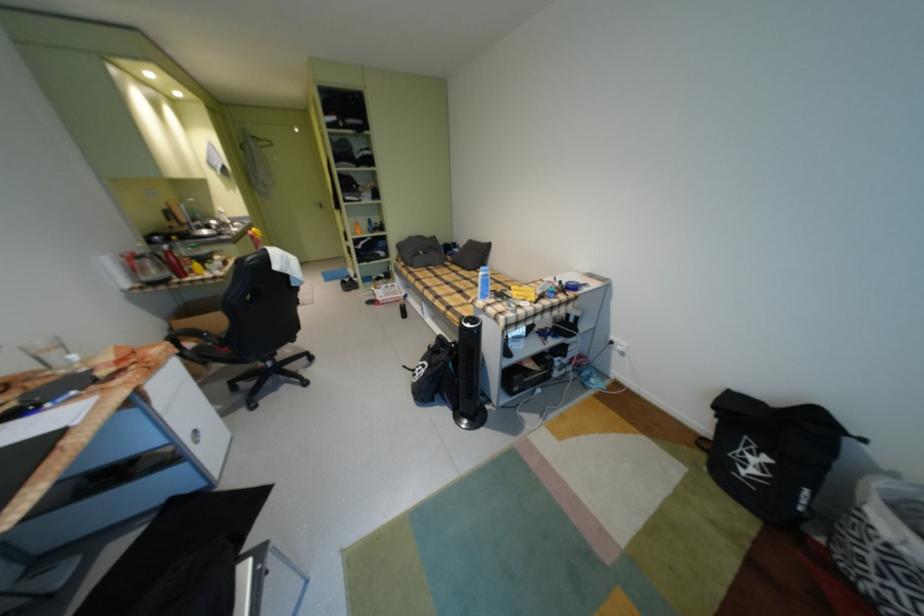
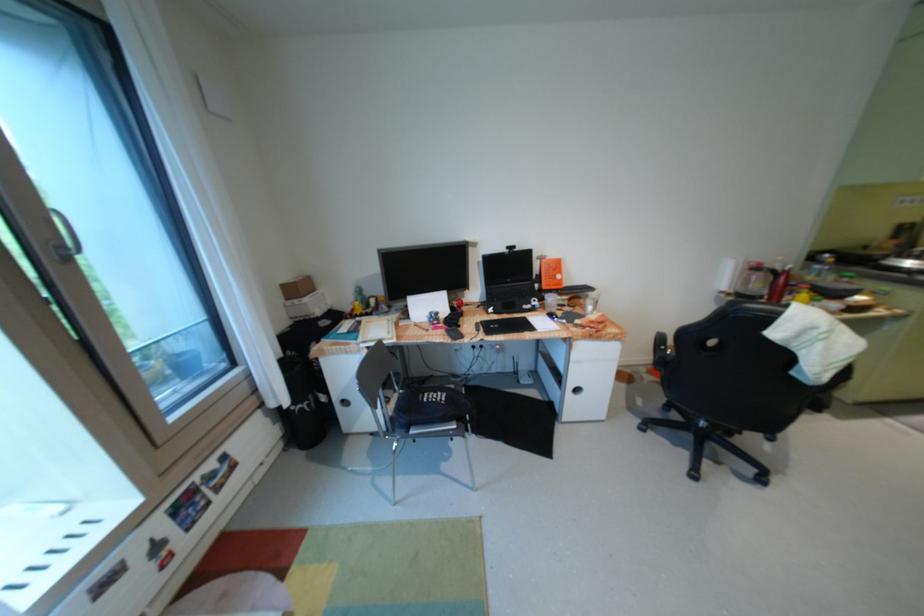
Where in the second image is the point corresponding to the point at 159,264 from the first image?

(768, 277)